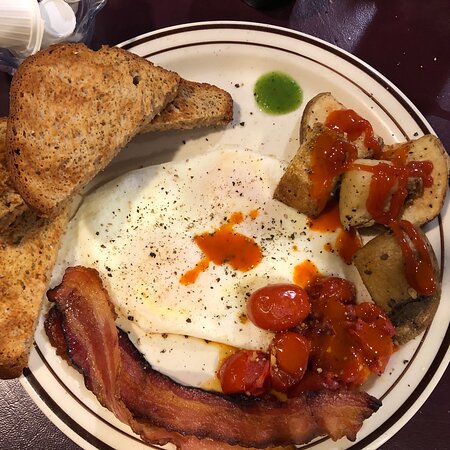
This screenshot has height=450, width=450. What are the coordinates of `dining table` in the screenshot? It's located at (360, 26), (418, 437), (34, 427).